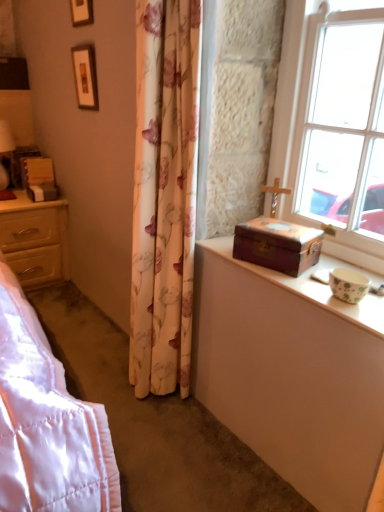
Question: From the image's perspective, is wooden picture frame at upper left, which is the 1th picture frame from bottom to top, positioned above or below wooden chest at right?

Choices:
 (A) below
 (B) above

Answer: (B)

Question: From a real-world perspective, is wooden picture frame at upper left, which is the 1th picture frame from bottom to top, physically located above or below wooden chest at right?

Choices:
 (A) below
 (B) above

Answer: (B)

Question: Estimate the real-world distances between objects in this image. Which object is farther from the clear glass window at upper right?

Choices:
 (A) wooden at left
 (B) wooden picture frame at upper left, acting as the first picture frame starting from the top
 (C) wooden treasure chest at window sill
 (D) wooden picture frame at upper left, arranged as the second picture frame when viewed from the top
 (E) floral fabric curtain at center

Answer: (A)

Question: Which object is positioned closest to the matte white table lamp at left?

Choices:
 (A) wooden treasure chest at window sill
 (B) wooden chest at right
 (C) wooden at left
 (D) clear glass window at upper right
 (E) floral fabric curtain at center

Answer: (C)